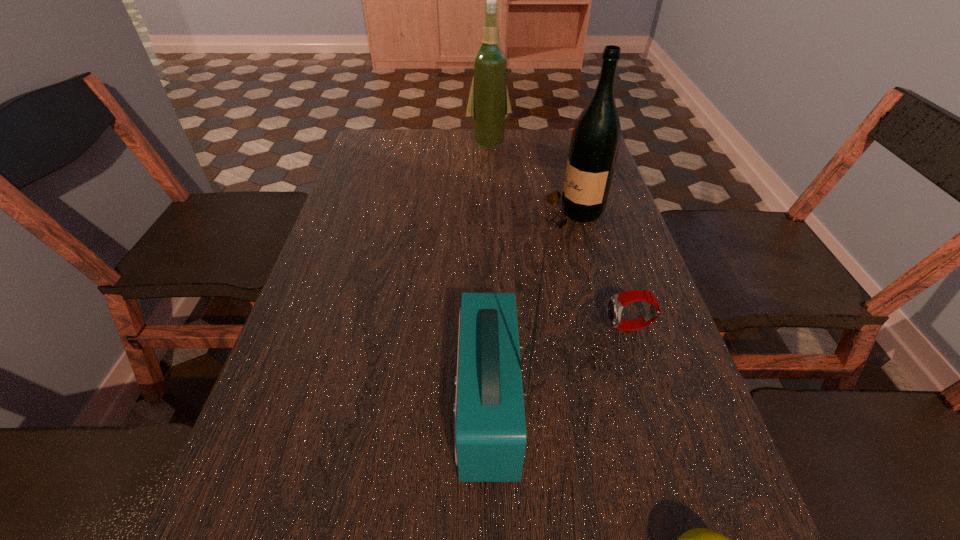
Find the location of a particular element. The height and width of the screenshot is (540, 960). the farther wine bottle is located at coordinates (488, 106).

The width and height of the screenshot is (960, 540). In order to click on the left wine bottle in this screenshot , I will do `click(488, 106)`.

Where is `the right wine bottle`? This screenshot has height=540, width=960. the right wine bottle is located at coordinates (595, 140).

Find the location of a particular element. the fourth nearest object is located at coordinates (595, 140).

Where is `radio receiver`? This screenshot has height=540, width=960. radio receiver is located at coordinates (490, 437).

Locate an element on the screen. The width and height of the screenshot is (960, 540). the third nearest object is located at coordinates (616, 303).

This screenshot has height=540, width=960. I want to click on free space located on the front-facing side of the farther wine bottle, so click(x=491, y=204).

The image size is (960, 540). Identify the location of vacant space situated 0.140m on the surface of the right wine bottle. (491, 213).

Find the location of a particular element. The width and height of the screenshot is (960, 540). free space located 0.260m on the surface of the right wine bottle is located at coordinates (444, 213).

I want to click on vacant space situated 0.330m on the surface of the right wine bottle, so click(419, 213).